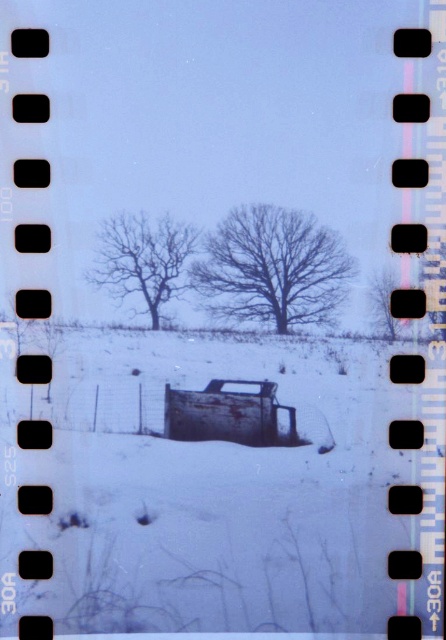
You are an observer looking at the winter landscape through the film strip frame. You notice two objects labeled as the bare wood tree at center and the bare branches at center. Which of these two objects appears closer to the top of the frame?

The bare wood tree at center is located above the bare branches at center, so it appears closer to the top of the frame.

You are a photographer who wants to capture a closeup of the rusty metal truck at center without the bare branches at center appearing in the frame. Which direction should you move the camera to achieve this?

The bare branches at center are to the left of the rusty metal truck at center. To avoid capturing them, move the camera to the right side of the truck.

You are a photographer who wants to capture a photo of the rusty metal truck at center and the smooth brown tree at center. Based on their sizes, which one will appear larger in the photo?

The smooth brown tree at center is taller than the rusty metal truck at center, so it will appear larger in the photo.